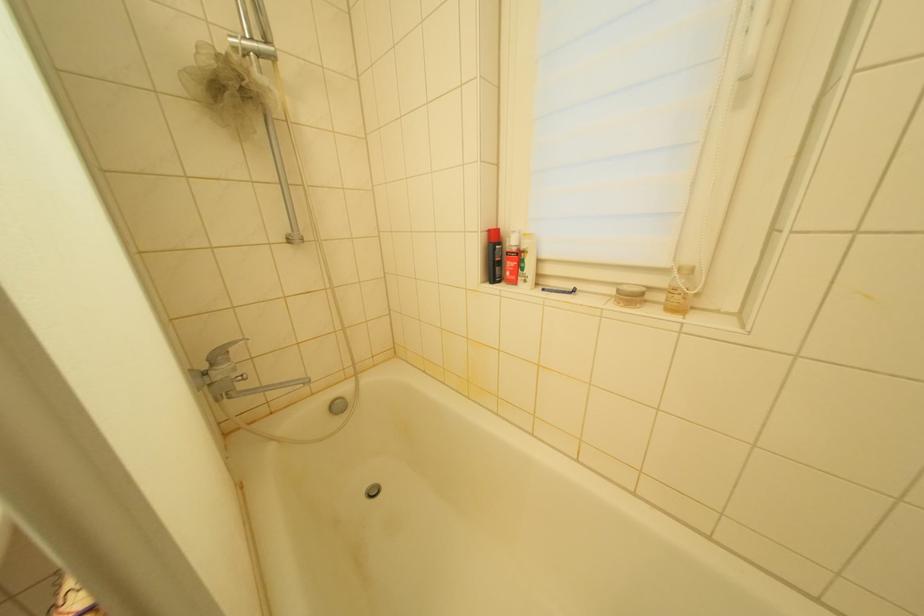
What do you see at coordinates (629, 294) in the screenshot? I see `a small jar lid` at bounding box center [629, 294].